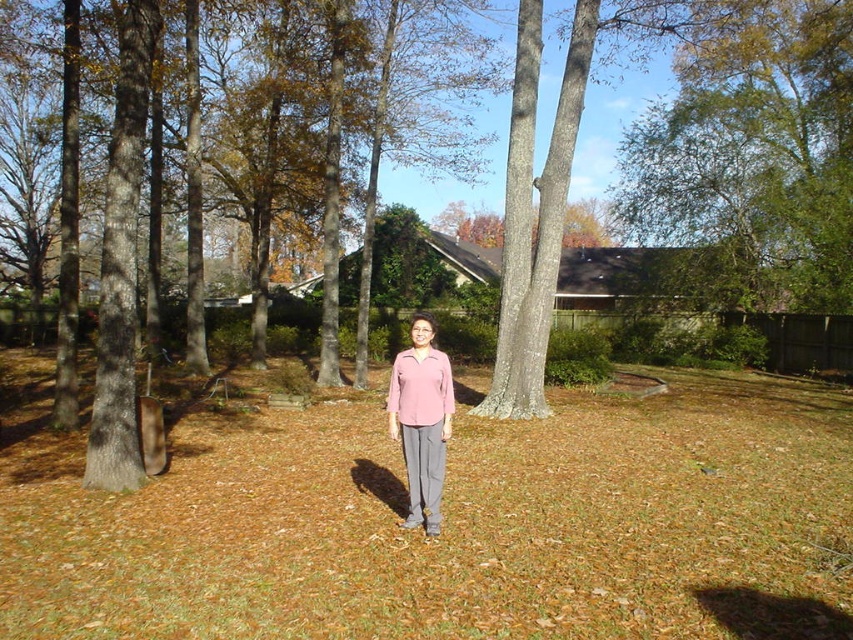
Question: Which point is closer to the camera?

Choices:
 (A) brown grass at center
 (B) pink matte sweater at center
 (C) pink matte shirt at center

Answer: (A)

Question: Does brown grass at center have a smaller size compared to pink matte shirt at center?

Choices:
 (A) no
 (B) yes

Answer: (A)

Question: Which of the following is the farthest from the observer?

Choices:
 (A) brown grass at center
 (B) pink matte shirt at center

Answer: (B)

Question: Is brown grass at center above pink matte sweater at center?

Choices:
 (A) no
 (B) yes

Answer: (A)

Question: Does pink matte shirt at center appear under pink matte sweater at center?

Choices:
 (A) no
 (B) yes

Answer: (B)

Question: Which of the following is the farthest from the observer?

Choices:
 (A) brown grass at center
 (B) pink matte shirt at center

Answer: (B)